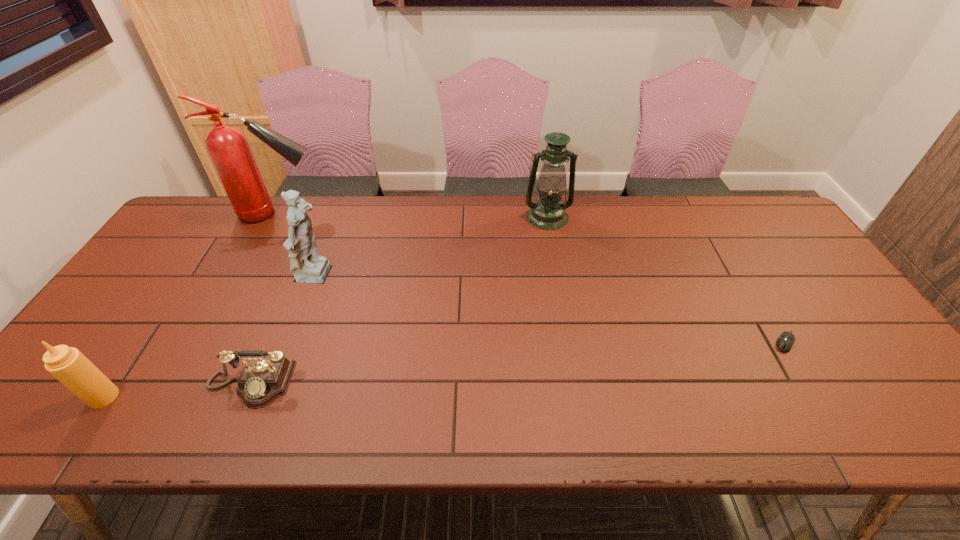
Image resolution: width=960 pixels, height=540 pixels. Identify the location of empty location between the figurine and the fourth tallest object. (210, 338).

In order to click on the fifth closest object to the fourth farthest object in this screenshot , I will do `click(67, 364)`.

You are a GUI agent. You are given a task and a screenshot of the screen. Output one action in this format:
    pyautogui.click(x=<x>, y=<y>)
    Task: Click on the object that is the third closest to the telephone
    
    Given the screenshot: What is the action you would take?
    [228, 148]

Where is `free spot that satisfies the following two spatial constraints: 1. on the back side of the condiment; 2. on the left side of the rightmost object`? free spot that satisfies the following two spatial constraints: 1. on the back side of the condiment; 2. on the left side of the rightmost object is located at coordinates (141, 342).

Image resolution: width=960 pixels, height=540 pixels. In order to click on free region that satisfies the following two spatial constraints: 1. on the front-facing side of the third farthest object; 2. on the left side of the computer mouse in this screenshot , I will do `click(294, 342)`.